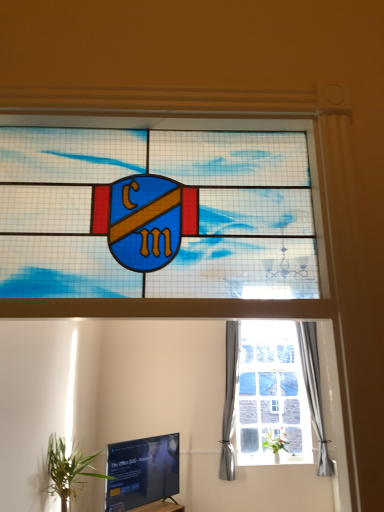
Question: Looking at the image, does green leafy plant at lower left, the 2th houseplant from the bottom, seem bigger or smaller compared to silky gray curtain at right, arranged as the first curtain when viewed from the right?

Choices:
 (A) small
 (B) big

Answer: (B)

Question: From a real-world perspective, is green leafy plant at lower left, the first houseplant from the top, positioned above or below silky gray curtain at right, arranged as the first curtain when viewed from the right?

Choices:
 (A) above
 (B) below

Answer: (B)

Question: Estimate the real-world distances between objects in this image. Which object is closer to the gray fabric curtain at right, which appears as the 2th curtain when viewed from the right?

Choices:
 (A) black glossy tv at lower left
 (B) silky gray curtain at right, arranged as the first curtain when viewed from the right
 (C) stained glass shield at center
 (D) green leafy plant at center, placed as the 2th houseplant when sorted from top to bottom
 (E) green leafy plant at lower left, which ranks as the 2th houseplant in right-to-left order

Answer: (D)

Question: Based on their relative distances, which object is nearer to the black glossy tv at lower left?

Choices:
 (A) silky gray curtain at right, arranged as the first curtain when viewed from the right
 (B) stained glass shield at center
 (C) green leafy plant at lower left, the first houseplant from the top
 (D) gray fabric curtain at right, which ranks as the first curtain in left-to-right order
 (E) green leafy plant at center, placed as the 2th houseplant when sorted from top to bottom

Answer: (C)